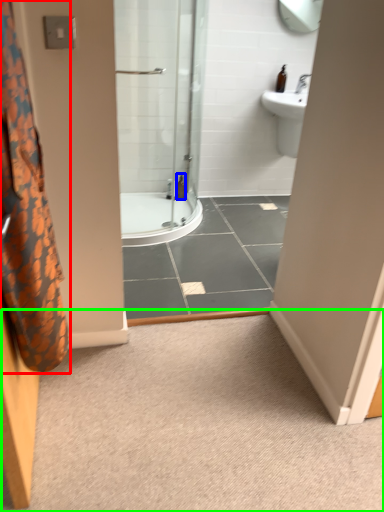
Question: Which object is the farthest from shower curtain (highlighted by a red box)? Choose among these: toiletry (highlighted by a blue box) or plain (highlighted by a green box).

Choices:
 (A) toiletry
 (B) plain

Answer: (A)